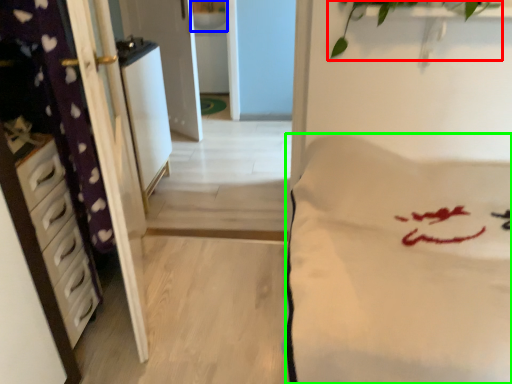
Question: Which object is the closest to the plant (highlighted by a red box)? Choose among these: sink (highlighted by a blue box) or mattress (highlighted by a green box).

Choices:
 (A) sink
 (B) mattress

Answer: (B)